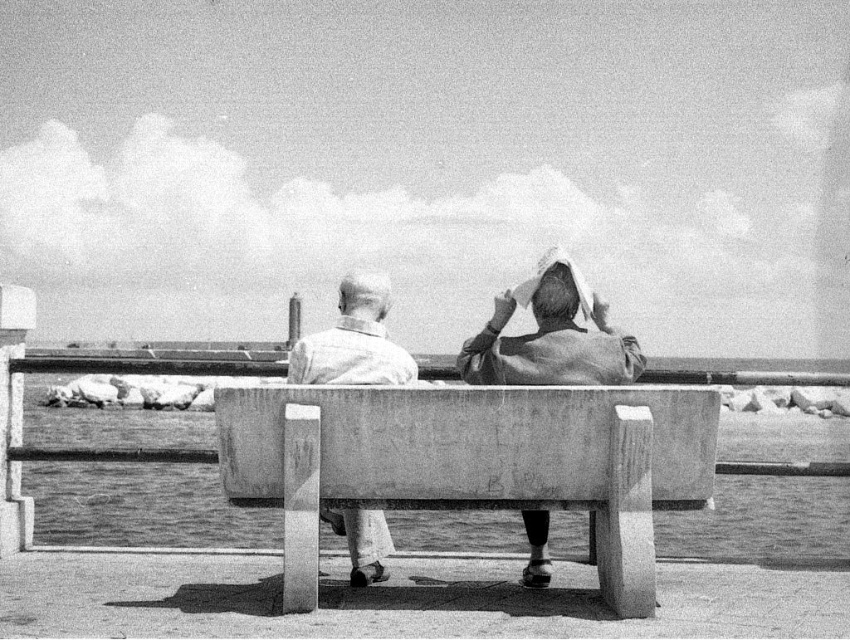
Who is more forward, (x=579, y=333) or (x=327, y=378)?

Point (x=327, y=378) is in front.

Does smooth leather jacket at center appear on the right side of smooth white shirt at center?

Correct, you'll find smooth leather jacket at center to the right of smooth white shirt at center.

Does point (578, 289) lie behind point (326, 332)?

No.

The image size is (850, 640). In order to click on smooth leather jacket at center in this screenshot , I will do `click(551, 336)`.

Between smooth concrete bench at center and smooth leather jacket at center, which one has more height?

With more height is smooth concrete bench at center.

Is point (415, 438) farther from camera compared to point (562, 376)?

No, it is not.

The image size is (850, 640). Find the location of `smooth concrete bench at center`. smooth concrete bench at center is located at coordinates (472, 461).

Can you confirm if smooth concrete bench at center is positioned below smooth white shirt at center?

Yes, smooth concrete bench at center is below smooth white shirt at center.

Between smooth concrete bench at center and smooth white shirt at center, which one has more height?

smooth concrete bench at center

Who is more distant from viewer, (505, 502) or (389, 344)?

The point (389, 344) is behind.

You are a GUI agent. You are given a task and a screenshot of the screen. Output one action in this format:
    pyautogui.click(x=<x>, y=<y>)
    Task: Click on the smooth concrete bench at center
    
    Given the screenshot: What is the action you would take?
    pyautogui.click(x=472, y=461)